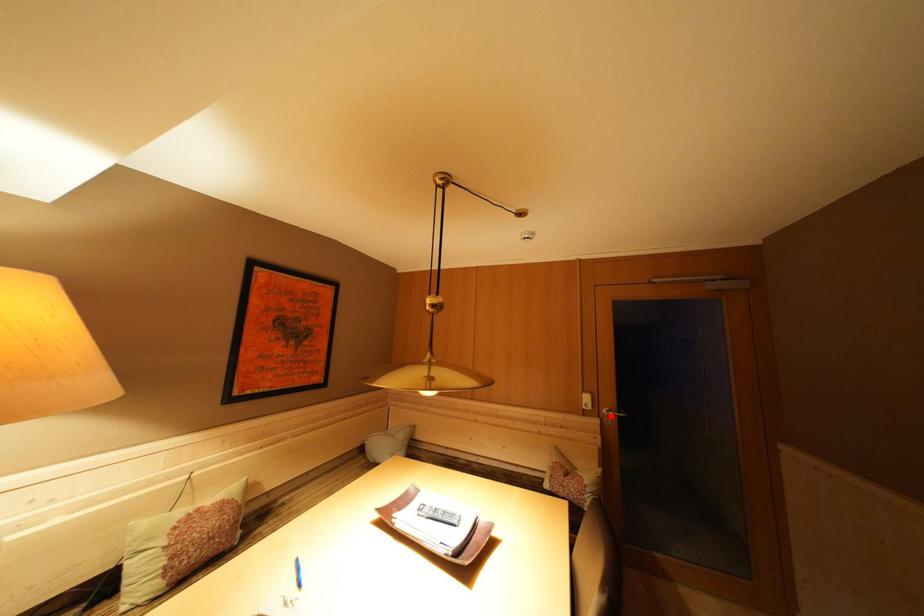
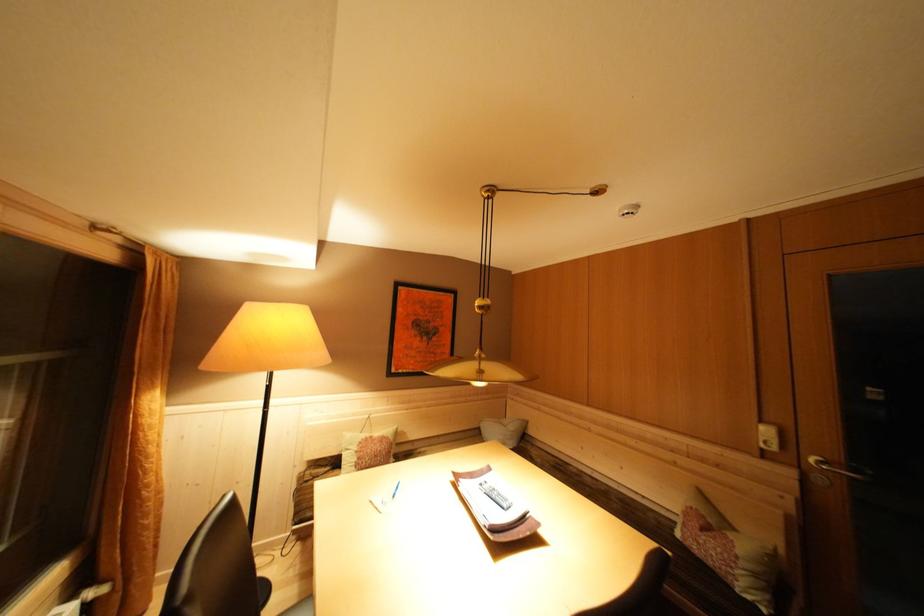
Question: I am providing you with two images of the same scene from different viewpoints. In image1, a red point is highlighted. Considering the same 3D point in image2, which of the following is correct?

Choices:
 (A) It is closer
 (B) It is farther

Answer: (A)